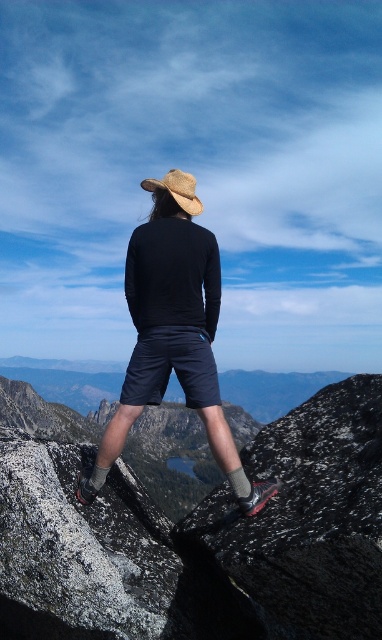
Who is taller, black textured rock at center or granite boulder at center?

With more height is black textured rock at center.

Who is positioned more to the left, black textured rock at center or granite boulder at center?

granite boulder at center

Who is more forward, (x=333, y=467) or (x=42, y=525)?

Positioned in front is point (x=42, y=525).

Where is `black textured rock at center`? black textured rock at center is located at coordinates (307, 518).

Is point (163, 369) positioned after point (176, 189)?

That is False.

Locate an element on the screen. The width and height of the screenshot is (382, 640). dark blue cotton shorts at center is located at coordinates (171, 368).

How distant is black textured rock at center from matte black shirt at center?

A distance of 3.47 feet exists between black textured rock at center and matte black shirt at center.

Based on the photo, between black textured rock at center and matte black shirt at center, which one is positioned lower?

Positioned lower is black textured rock at center.

Who is more forward, (372, 564) or (191, 340)?

Positioned in front is point (372, 564).

The width and height of the screenshot is (382, 640). In order to click on black textured rock at center in this screenshot , I will do `click(307, 518)`.